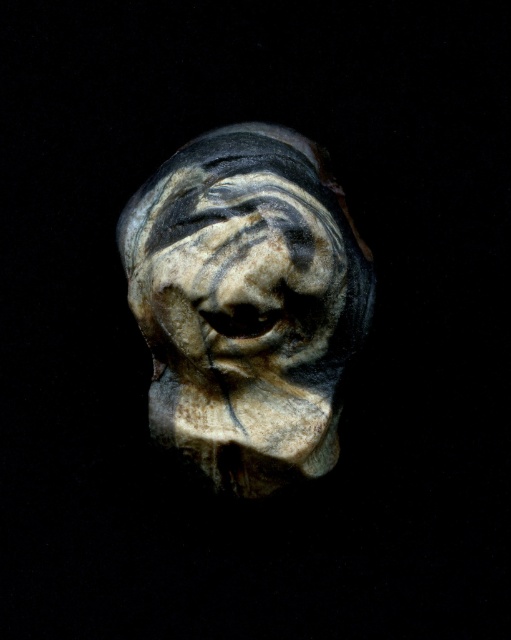
Question: Which object appears closest to the camera in this image?

Choices:
 (A) speckled stone head at center
 (B) speckled stone face at center

Answer: (A)

Question: Can you confirm if speckled stone head at center is wider than speckled stone face at center?

Choices:
 (A) no
 (B) yes

Answer: (B)

Question: Which point is farther from the camera taking this photo?

Choices:
 (A) [197, 196]
 (B) [278, 182]

Answer: (A)

Question: Does speckled stone head at center appear under speckled stone face at center?

Choices:
 (A) yes
 (B) no

Answer: (A)

Question: Does speckled stone head at center appear on the right side of speckled stone face at center?

Choices:
 (A) yes
 (B) no

Answer: (B)